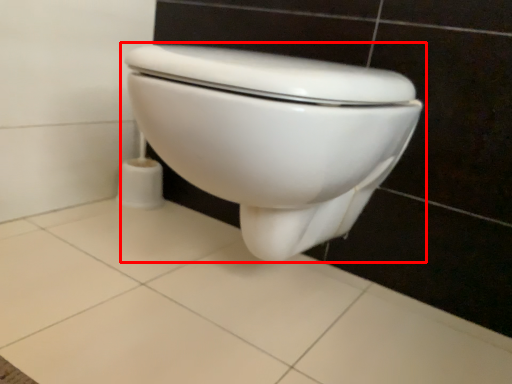
Question: From the image's perspective, what is the correct spatial positioning of toilet (annotated by the red box) in reference to ceramic tile?

Choices:
 (A) above
 (B) below

Answer: (A)